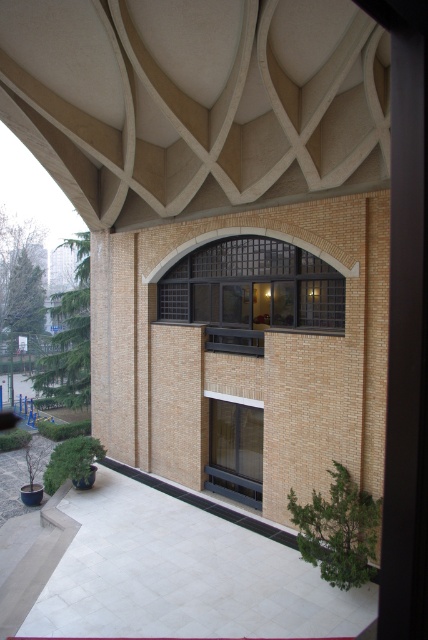
Can you confirm if black metal window at center is bigger than clear glass window at center?

Yes, black metal window at center is bigger than clear glass window at center.

Between black metal window at center and clear glass window at center, which one is positioned higher?

black metal window at center is above.

Does point (279, 323) come farther from viewer compared to point (216, 400)?

No, (279, 323) is closer to viewer.

Identify the location of black metal window at center. (252, 291).